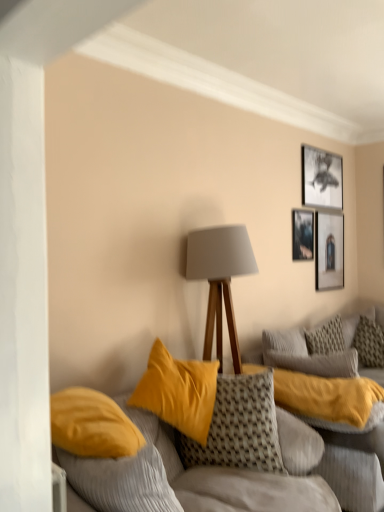
What is the approximate width of textured gray pillow at right, the second pillow from the left?

It is 13.35 inches.

Measure the distance between point (x=302, y=177) and camera.

Point (x=302, y=177) is 3.67 meters from camera.

Where is `textured woven pillow at center, acting as the 2th pillow starting from the right`? textured woven pillow at center, acting as the 2th pillow starting from the right is located at coordinates (328, 398).

Considering the relative sizes of textured woven pillow at center, acting as the 2th pillow starting from the right, and black matte picture frame at upper right, the first picture frame when ordered from top to bottom, in the image provided, is textured woven pillow at center, acting as the 2th pillow starting from the right, thinner than black matte picture frame at upper right, the first picture frame when ordered from top to bottom,?

No, textured woven pillow at center, acting as the 2th pillow starting from the right, is not thinner than black matte picture frame at upper right, the first picture frame when ordered from top to bottom.

Is textured woven pillow at center, acting as the 1th pillow starting from the front, at the left side of black matte picture frame at upper right, the first picture frame when ordered from top to bottom?

Yes.

From the image's perspective, is textured woven pillow at center, acting as the 2th pillow starting from the back, above or below black matte picture frame at upper right, the first picture frame when ordered from top to bottom?

textured woven pillow at center, acting as the 2th pillow starting from the back, is below black matte picture frame at upper right, the first picture frame when ordered from top to bottom.

Considering the sizes of objects matte gray lampshade at center and textured gray pillow at right, the second pillow from the left, in the image provided, who is taller, matte gray lampshade at center or textured gray pillow at right, the second pillow from the left,?

Standing taller between the two is matte gray lampshade at center.

How far apart are matte gray lampshade at center and textured gray pillow at right, the second pillow from the left?

matte gray lampshade at center is 5.52 feet away from textured gray pillow at right, the second pillow from the left.

Looking at their sizes, would you say matte gray lampshade at center is wider or thinner than textured gray pillow at right, placed as the first pillow when sorted from right to left?

Clearly, matte gray lampshade at center has more width compared to textured gray pillow at right, placed as the first pillow when sorted from right to left.

From a real-world perspective, is matte gray lampshade at center located higher than textured gray pillow at right, the second pillow from the left?

Yes.

Which is behind, textured woven pillow at center, acting as the 1th pillow starting from the front, or velvet yellow cushions at center?

textured woven pillow at center, acting as the 1th pillow starting from the front, is further from the camera.

Considering the relative sizes of textured woven pillow at center, acting as the 2th pillow starting from the back, and velvet yellow cushions at center in the image provided, is textured woven pillow at center, acting as the 2th pillow starting from the back, thinner than velvet yellow cushions at center?

Yes.

Which pillow is the 1st one when counting from the back of the velvet yellow cushions at center? Please provide its 2D coordinates.

[(328, 398)]

Based on the photo, is textured woven pillow at center, acting as the 2th pillow starting from the right, bigger or smaller than velvet yellow cushions at center?

textured woven pillow at center, acting as the 2th pillow starting from the right, is smaller than velvet yellow cushions at center.

From a real-world perspective, is velvet yellow cushions at center physically located above or below black matte picture frame at upper right, the first picture frame when ordered from top to bottom?

velvet yellow cushions at center is below black matte picture frame at upper right, the first picture frame when ordered from top to bottom.

Who is smaller, velvet yellow cushions at center or black matte picture frame at upper right, the first picture frame when ordered from top to bottom?

black matte picture frame at upper right, the first picture frame when ordered from top to bottom, is smaller.

From the image's perspective, is velvet yellow cushions at center located beneath black matte picture frame at upper right, the first picture frame when ordered from top to bottom?

Yes.

Which point is more forward, (343, 460) or (311, 159)?

The point (343, 460) is closer.

Can velvet yellow cushions at center be found inside matte black picture frame at upper right, which is the first picture frame in bottom-to-top order?

Definitely not — velvet yellow cushions at center is not inside matte black picture frame at upper right, which is the first picture frame in bottom-to-top order.

Is the position of matte black picture frame at upper right, which is the first picture frame in bottom-to-top order, less distant than that of velvet yellow cushions at center?

No, it is behind velvet yellow cushions at center.

From the picture: From a real-world perspective, is matte black picture frame at upper right, which is counted as the third picture frame, starting from the top, on top of velvet yellow cushions at center?

Yes, from a real-world perspective, matte black picture frame at upper right, which is counted as the third picture frame, starting from the top, is above velvet yellow cushions at center.

Where is `studio couch to the left of matte black picture frame at upper right, which is the first picture frame in bottom-to-top order`? studio couch to the left of matte black picture frame at upper right, which is the first picture frame in bottom-to-top order is located at coordinates (336, 461).

Is matte gray lampshade at center placed right next to black matte picture frame at upper right, which is counted as the 3th picture frame, starting from the bottom?

They are not placed beside each other.

Can you confirm if matte gray lampshade at center is taller than black matte picture frame at upper right, the first picture frame when ordered from top to bottom?

Correct, matte gray lampshade at center is much taller as black matte picture frame at upper right, the first picture frame when ordered from top to bottom.

Looking at their sizes, would you say matte gray lampshade at center is wider or thinner than black matte picture frame at upper right, the first picture frame when ordered from top to bottom?

In the image, matte gray lampshade at center appears to be wider than black matte picture frame at upper right, the first picture frame when ordered from top to bottom.

Which object is thinner, black matte picture frame at upper right, which is counted as the 3th picture frame, starting from the bottom, or textured gray pillow at right, the second pillow from the left?

black matte picture frame at upper right, which is counted as the 3th picture frame, starting from the bottom, is thinner.

From the image's perspective, would you say black matte picture frame at upper right, which is counted as the 3th picture frame, starting from the bottom, is positioned over textured gray pillow at right, the second pillow from the left?

Yes, from the image's perspective, black matte picture frame at upper right, which is counted as the 3th picture frame, starting from the bottom, is above textured gray pillow at right, the second pillow from the left.

From the image's perspective, which pillow is the 1st one below the black matte picture frame at upper right, the first picture frame when ordered from top to bottom? Please provide its 2D coordinates.

[(369, 343)]

Considering the sizes of objects black matte picture frame at upper right, the first picture frame when ordered from top to bottom, and textured gray pillow at right, acting as the 1th pillow starting from the back, in the image provided, who is bigger, black matte picture frame at upper right, the first picture frame when ordered from top to bottom, or textured gray pillow at right, acting as the 1th pillow starting from the back,?

textured gray pillow at right, acting as the 1th pillow starting from the back, is bigger.

You are a GUI agent. You are given a task and a screenshot of the screen. Output one action in this format:
    pyautogui.click(x=<x>, y=<y>)
    Task: Click on the pillow lying on the left of black matte picture frame at upper right, the first picture frame when ordered from top to bottom
    The height and width of the screenshot is (512, 384).
    Given the screenshot: What is the action you would take?
    pyautogui.click(x=328, y=398)

At what (x,y) coordinates should I click in order to perform the action: click on lamp lying above the textured gray pillow at right, the second pillow from the left (from the image's perspective). Please return your answer as a coordinate pair (x, y). The width and height of the screenshot is (384, 512). Looking at the image, I should click on (220, 279).

Considering their positions, is matte black picture frame at upper right, which is counted as the third picture frame, starting from the top, positioned closer to black matte picture frame at upper right, the first picture frame when ordered from top to bottom, than textured gray pillow at right, placed as the first pillow when sorted from right to left?

matte black picture frame at upper right, which is counted as the third picture frame, starting from the top, is positioned closer to the anchor black matte picture frame at upper right, the first picture frame when ordered from top to bottom.

Looking at the image, which one is located further to black matte picture frame at upper right, the first picture frame when ordered from top to bottom, velvet yellow cushions at center or matte gray lampshade at center?

The object further to black matte picture frame at upper right, the first picture frame when ordered from top to bottom, is velvet yellow cushions at center.

Based on their spatial positions, is velvet yellow cushions at center or black matte picture frame at upper right, which is counted as the 3th picture frame, starting from the bottom, further from textured woven pillow at center, acting as the 2th pillow starting from the back?

black matte picture frame at upper right, which is counted as the 3th picture frame, starting from the bottom.

From the image, which object appears to be nearer to matte black picture frame at upper right, which is the first picture frame in bottom-to-top order, textured gray pillow at right, the second pillow from the left, or metallic silver picture frame at upper right, the second picture frame positioned from the bottom?

Among the two, metallic silver picture frame at upper right, the second picture frame positioned from the bottom, is located nearer to matte black picture frame at upper right, which is the first picture frame in bottom-to-top order.

Estimate the real-world distances between objects in this image. Which object is further from metallic silver picture frame at upper right, which is the second picture frame from top to bottom, black matte picture frame at upper right, which is counted as the 3th picture frame, starting from the bottom, or textured woven pillow at center, acting as the 2th pillow starting from the back?

textured woven pillow at center, acting as the 2th pillow starting from the back, is positioned further to the anchor metallic silver picture frame at upper right, which is the second picture frame from top to bottom.

Considering their positions, is textured gray pillow at right, placed as the first pillow when sorted from right to left, positioned further to textured woven pillow at center, acting as the 2th pillow starting from the right, than velvet yellow cushions at center?

textured gray pillow at right, placed as the first pillow when sorted from right to left, is further to textured woven pillow at center, acting as the 2th pillow starting from the right.

When comparing their distances from matte black picture frame at upper right, which is counted as the third picture frame, starting from the top, does black matte picture frame at upper right, the first picture frame when ordered from top to bottom, or metallic silver picture frame at upper right, the second picture frame positioned from the bottom, seem closer?

metallic silver picture frame at upper right, the second picture frame positioned from the bottom, lies closer to matte black picture frame at upper right, which is counted as the third picture frame, starting from the top, than the other object.

Which object lies nearer to the anchor point matte gray lampshade at center, metallic silver picture frame at upper right, the second picture frame positioned from the bottom, or textured gray pillow at right, marked as the 2th pillow in a front-to-back arrangement?

metallic silver picture frame at upper right, the second picture frame positioned from the bottom, lies closer to matte gray lampshade at center than the other object.

You are a GUI agent. You are given a task and a screenshot of the screen. Output one action in this format:
    pyautogui.click(x=<x>, y=<y>)
    Task: Click on the lamp between velvet yellow cushions at center and black matte picture frame at upper right, the first picture frame when ordered from top to bottom, from front to back
    Image resolution: width=384 pixels, height=512 pixels.
    Given the screenshot: What is the action you would take?
    pyautogui.click(x=220, y=279)

At what (x,y) coordinates should I click in order to perform the action: click on lamp between textured woven pillow at center, acting as the 1th pillow starting from the front, and black matte picture frame at upper right, which is counted as the 3th picture frame, starting from the bottom, in the front-back direction. Please return your answer as a coordinate pair (x, y). Looking at the image, I should click on (220, 279).

At what (x,y) coordinates should I click in order to perform the action: click on pillow located between textured woven pillow at center, acting as the 2th pillow starting from the back, and black matte picture frame at upper right, the first picture frame when ordered from top to bottom, in the depth direction. Please return your answer as a coordinate pair (x, y). Looking at the image, I should click on (369, 343).

You are a GUI agent. You are given a task and a screenshot of the screen. Output one action in this format:
    pyautogui.click(x=<x>, y=<y>)
    Task: Click on the lamp between velvet yellow cushions at center and matte black picture frame at upper right, which is the first picture frame in bottom-to-top order, in the front-back direction
    This screenshot has width=384, height=512.
    Given the screenshot: What is the action you would take?
    pyautogui.click(x=220, y=279)